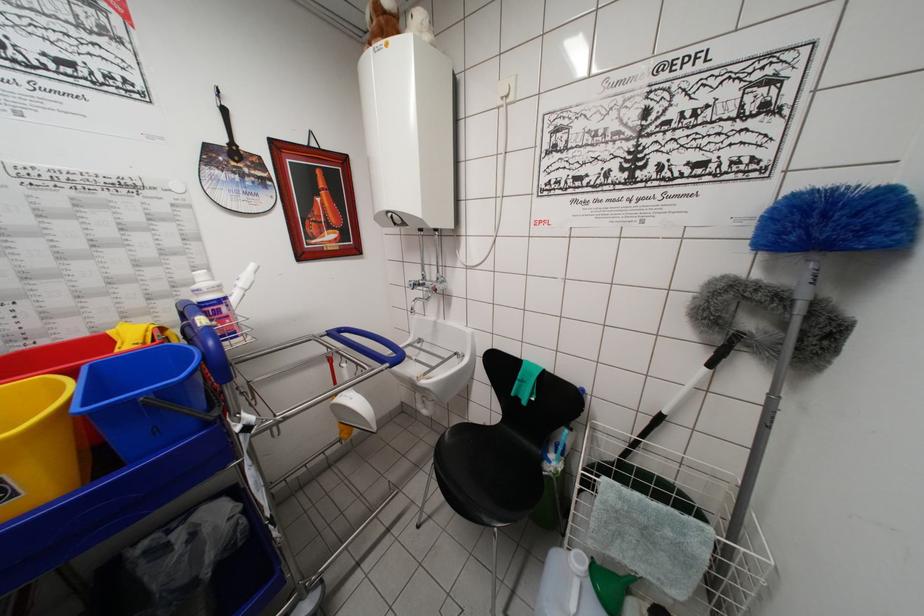
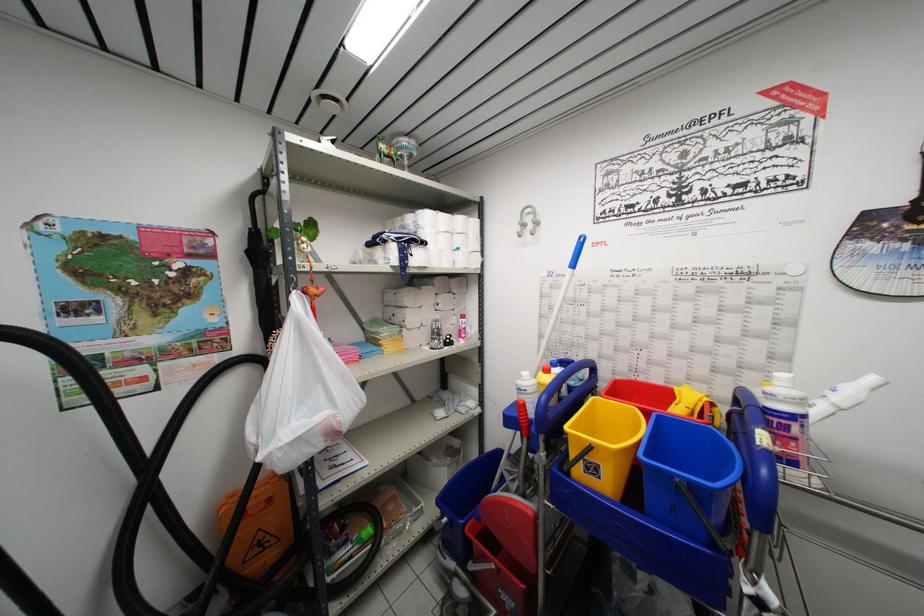
Locate, in the second image, the point that corresponds to the point at 209,430 in the first image.

(718, 552)